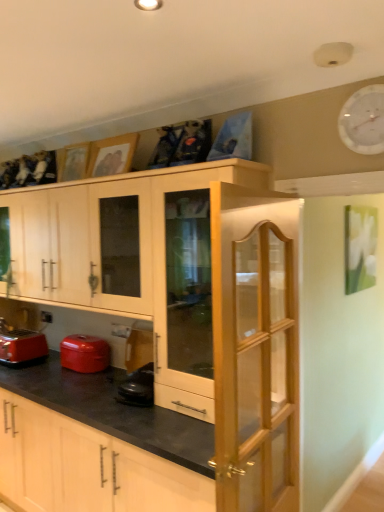
Measure the distance between point (61, 354) and camera.

Point (61, 354) is 9.53 feet from camera.

The image size is (384, 512). Describe the element at coordinates (255, 352) in the screenshot. I see `light wood/glass cabinet door at center` at that location.

Measure the distance between point (245, 432) and camera.

1.78 meters.

The width and height of the screenshot is (384, 512). What do you see at coordinates (73, 162) in the screenshot?
I see `wooden picture frame at upper left, which appears as the second picture frame when viewed from the right` at bounding box center [73, 162].

Measure the distance between matte red toaster at lower left and camera.

9.23 feet.

This screenshot has height=512, width=384. What are the coordinates of `matte wood cabinet at lower center` in the screenshot? It's located at (165, 340).

Can you confirm if matte wood cabinet at lower center is positioned to the left of light wood/glass cabinet door at center?

Correct, you'll find matte wood cabinet at lower center to the left of light wood/glass cabinet door at center.

Consider the image. Considering the relative sizes of matte wood cabinet at lower center and light wood/glass cabinet door at center in the image provided, is matte wood cabinet at lower center thinner than light wood/glass cabinet door at center?

No.

Are matte wood cabinet at lower center and light wood/glass cabinet door at center located far from each other?

No, matte wood cabinet at lower center is not far from light wood/glass cabinet door at center.

Is matte wood cabinet at lower center turned away from light wood/glass cabinet door at center?

No.

At what (x,y) coordinates should I click in order to perform the action: click on picture frame that is the 2nd one when counting leftward from the light wood/glass cabinet door at center. Please return your answer as a coordinate pair (x, y). This screenshot has height=512, width=384. Looking at the image, I should click on (73, 162).

Does light wood/glass cabinet door at center appear on the left side of wooden picture frame at upper left, placed as the first picture frame when sorted from back to front?

Incorrect, light wood/glass cabinet door at center is not on the left side of wooden picture frame at upper left, placed as the first picture frame when sorted from back to front.

Could you tell me if light wood/glass cabinet door at center is facing wooden picture frame at upper left, the 2th picture frame when ordered from front to back?

No, light wood/glass cabinet door at center is not oriented towards wooden picture frame at upper left, the 2th picture frame when ordered from front to back.

Considering the sizes of wooden picture frame at upper left, marked as the first picture frame in a left-to-right arrangement, and wooden picture frame at upper center, the second picture frame in the left-to-right sequence, in the image, is wooden picture frame at upper left, marked as the first picture frame in a left-to-right arrangement, bigger or smaller than wooden picture frame at upper center, the second picture frame in the left-to-right sequence,?

Clearly, wooden picture frame at upper left, marked as the first picture frame in a left-to-right arrangement, is smaller in size than wooden picture frame at upper center, the second picture frame in the left-to-right sequence.

Does point (71, 166) lie in front of point (135, 146)?

That is False.

The height and width of the screenshot is (512, 384). I want to click on picture frame that is under the wooden picture frame at upper center, positioned as the first picture frame in right-to-left order (from a real-world perspective), so click(73, 162).

Does light wood/glass cabinet door at center touch white glossy clock at upper right?

No, light wood/glass cabinet door at center is not making contact with white glossy clock at upper right.

Could you tell me if light wood/glass cabinet door at center is facing white glossy clock at upper right?

No, light wood/glass cabinet door at center is not turned towards white glossy clock at upper right.

Between light wood/glass cabinet door at center and white glossy clock at upper right, which one has smaller width?

Thinner between the two is white glossy clock at upper right.

From the image's perspective, would you say light wood/glass cabinet door at center is positioned over white glossy clock at upper right?

No, from the image's perspective, light wood/glass cabinet door at center is not above white glossy clock at upper right.

Relative to wooden picture frame at upper center, positioned as the first picture frame in right-to-left order, is light wood/glass cabinet door at center in front or behind?

light wood/glass cabinet door at center is in front of wooden picture frame at upper center, positioned as the first picture frame in right-to-left order.

From the light wood/glass cabinet door at center, count the 1st picture frame to the left and point to it. Please provide its 2D coordinates.

[(112, 155)]

From a real-world perspective, is light wood/glass cabinet door at center positioned under wooden picture frame at upper center, which appears as the second picture frame when viewed from the back, based on gravity?

Yes.

From the image's perspective, between light wood/glass cabinet door at center and wooden picture frame at upper center, which appears as the second picture frame when viewed from the back, which one is located above?

From the image's view, wooden picture frame at upper center, which appears as the second picture frame when viewed from the back, is above.

Is light wood/glass cabinet door at center completely or partially outside of matte red pot at lower left?

That's correct, light wood/glass cabinet door at center is outside of matte red pot at lower left.

Based on the photo, how many degrees apart are the facing directions of light wood/glass cabinet door at center and matte red pot at lower left?

96.3 degrees.

Which of these two, light wood/glass cabinet door at center or matte red pot at lower left, is wider?

matte red pot at lower left is wider.

From the image's perspective, is matte red pot at lower left above wooden picture frame at upper center, which appears as the second picture frame when viewed from the back?

Actually, matte red pot at lower left appears below wooden picture frame at upper center, which appears as the second picture frame when viewed from the back, in the image.

Can you confirm if matte red pot at lower left is shorter than wooden picture frame at upper center, positioned as the first picture frame in right-to-left order?

Indeed, matte red pot at lower left has a lesser height compared to wooden picture frame at upper center, positioned as the first picture frame in right-to-left order.

Which is more to the left, matte red pot at lower left or wooden picture frame at upper center, which appears as the second picture frame when viewed from the back?

Positioned to the left is matte red pot at lower left.

Which of these two, matte red pot at lower left or wooden picture frame at upper center, the second picture frame in the left-to-right sequence, is wider?

matte red pot at lower left.

At what (x,y) coordinates should I click in order to perform the action: click on screen door above the matte wood cabinet at lower center (from a real-world perspective). Please return your answer as a coordinate pair (x, y). Looking at the image, I should click on (255, 352).

Which picture frame is the 2nd one when counting from the back of the light wood/glass cabinet door at center? Please provide its 2D coordinates.

[(73, 162)]

Looking at the image, which one is located closer to matte red pot at lower left, matte wood cabinet at lower center or white glossy clock at upper right?

Among the two, matte wood cabinet at lower center is located nearer to matte red pot at lower left.

Which object lies nearer to the anchor point wooden picture frame at upper left, marked as the first picture frame in a left-to-right arrangement, wooden picture frame at upper center, the first picture frame from the front, or light wood/glass cabinet door at center?

The object closer to wooden picture frame at upper left, marked as the first picture frame in a left-to-right arrangement, is wooden picture frame at upper center, the first picture frame from the front.

Looking at the image, which one is located further to matte red pot at lower left, light wood/glass cabinet door at center or wooden picture frame at upper left, placed as the first picture frame when sorted from back to front?

The object further to matte red pot at lower left is light wood/glass cabinet door at center.

Looking at the image, which one is located closer to white glossy clock at upper right, matte red toaster at lower left or matte wood cabinet at lower center?

matte wood cabinet at lower center is closer to white glossy clock at upper right.

From the image, which object appears to be farther from wooden picture frame at upper left, placed as the first picture frame when sorted from back to front, light wood/glass cabinet door at center or matte wood cabinet at lower center?

light wood/glass cabinet door at center.

Based on their spatial positions, is wooden picture frame at upper left, the 2th picture frame when ordered from front to back, or wooden picture frame at upper center, the second picture frame in the left-to-right sequence, closer to white glossy clock at upper right?

Among the two, wooden picture frame at upper center, the second picture frame in the left-to-right sequence, is located nearer to white glossy clock at upper right.

Considering their positions, is wooden picture frame at upper center, the second picture frame in the left-to-right sequence, positioned closer to matte red toaster at lower left than matte red pot at lower left?

Based on the image, matte red pot at lower left appears to be nearer to matte red toaster at lower left.

From the image, which object appears to be farther from matte red pot at lower left, wooden picture frame at upper left, the 2th picture frame when ordered from front to back, or wooden picture frame at upper center, which appears as the second picture frame when viewed from the back?

wooden picture frame at upper center, which appears as the second picture frame when viewed from the back, lies further to matte red pot at lower left than the other object.

You are a GUI agent. You are given a task and a screenshot of the screen. Output one action in this format:
    pyautogui.click(x=<x>, y=<y>)
    Task: Click on the screen door between wooden picture frame at upper center, which appears as the second picture frame when viewed from the back, and matte red pot at lower left in the up-down direction
    The height and width of the screenshot is (512, 384).
    Given the screenshot: What is the action you would take?
    pyautogui.click(x=255, y=352)

Locate an element on the screen. The width and height of the screenshot is (384, 512). appliance situated between wooden picture frame at upper left, marked as the first picture frame in a left-to-right arrangement, and white glossy clock at upper right from left to right is located at coordinates (84, 353).

The height and width of the screenshot is (512, 384). I want to click on screen door between matte red pot at lower left and white glossy clock at upper right in the horizontal direction, so click(x=255, y=352).

Locate an element on the screen. picture frame between wooden picture frame at upper left, the 2th picture frame when ordered from front to back, and matte wood cabinet at lower center in the up-down direction is located at coordinates (112, 155).